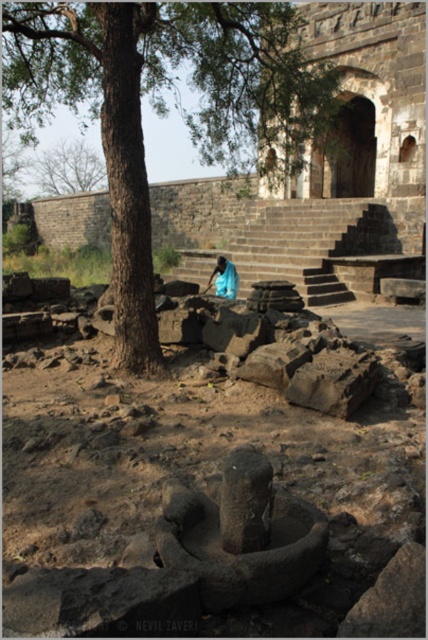
Question: Which object appears closest to the camera in this image?

Choices:
 (A) gray rough stone at center
 (B) brown rough tree at upper left
 (C) brown rough tree at center
 (D) brown earthy dirt field at center

Answer: (D)

Question: Is the position of brown rough tree at upper left less distant than that of gray rough stone at center?

Choices:
 (A) no
 (B) yes

Answer: (A)

Question: Which object is closer to the camera taking this photo?

Choices:
 (A) brown rough tree at center
 (B) brown rough tree at upper left

Answer: (A)

Question: Estimate the real-world distances between objects in this image. Which object is closer to the blue fabric person at center?

Choices:
 (A) gray rough stone at center
 (B) brown rough tree at center
 (C) brown rough tree at upper left
 (D) brown earthy dirt field at center

Answer: (A)

Question: Can you confirm if brown earthy dirt field at center is thinner than gray rough stone at center?

Choices:
 (A) no
 (B) yes

Answer: (A)

Question: Does brown earthy dirt field at center have a smaller size compared to gray rough stone at center?

Choices:
 (A) no
 (B) yes

Answer: (A)